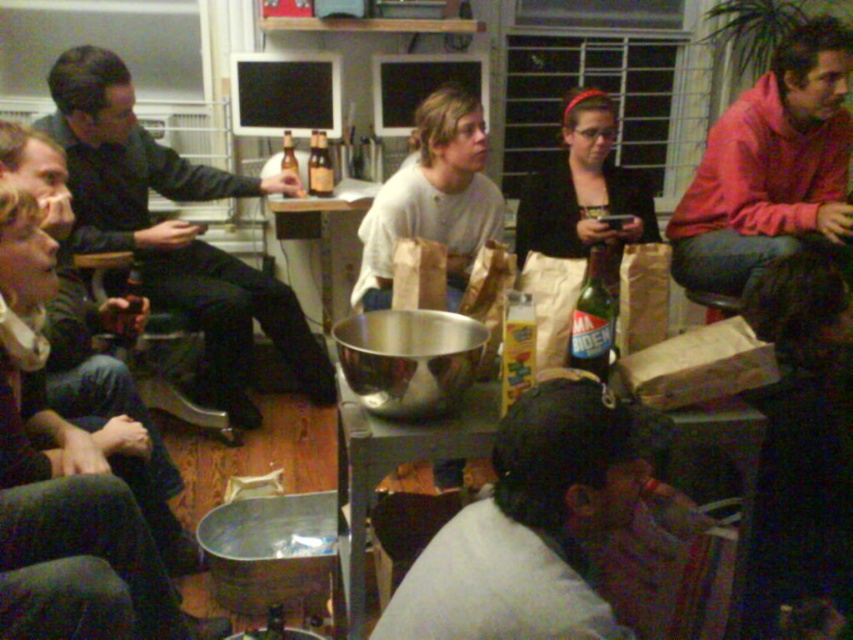
Does matte black shirt at left appear under green glass bottle at center?

No.

Is point (100, 104) in front of point (598, 257)?

No, it is behind (598, 257).

Is point (141, 204) positioned behind point (584, 336)?

Yes, point (141, 204) is farther from viewer.

The height and width of the screenshot is (640, 853). What are the coordinates of `matte black shirt at left` in the screenshot? It's located at (173, 230).

Does dark gray fabric at lower center appear over green glass bottle at center?

Actually, dark gray fabric at lower center is below green glass bottle at center.

Is dark gray fabric at lower center positioned in front of green glass bottle at center?

Yes, it is.

You are a GUI agent. You are given a task and a screenshot of the screen. Output one action in this format:
    pyautogui.click(x=<x>, y=<y>)
    Task: Click on the dark gray fabric at lower center
    The width and height of the screenshot is (853, 640).
    Given the screenshot: What is the action you would take?
    pyautogui.click(x=532, y=524)

Between point (749, 284) and point (318, 182), which one is positioned behind?

Positioned behind is point (318, 182).

Is red fleece jacket at right bigger than translucent glass bottles at center?

Indeed, red fleece jacket at right has a larger size compared to translucent glass bottles at center.

Between point (822, 156) and point (322, 184), which one is positioned in front?

Point (822, 156)

At what (x,y) coordinates should I click in order to perform the action: click on red fleece jacket at right. Please return your answer as a coordinate pair (x, y). Looking at the image, I should click on (770, 168).